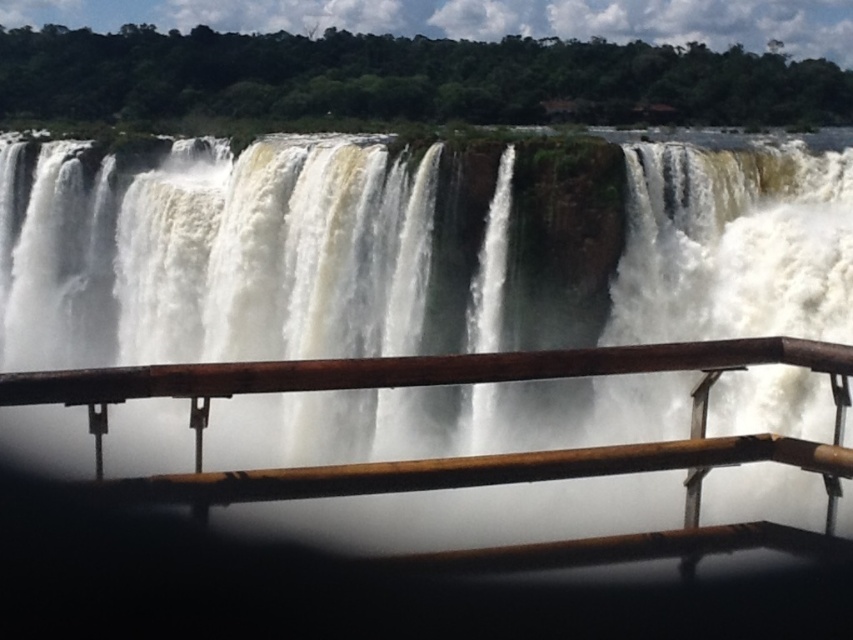
You are a park ranger assessing safety conditions at the waterfall. You notice the white frothy water at center and the brown wooden rail at center. Based on their heights, which one is higher from the ground?

The white frothy water at center is taller than the brown wooden rail at center, so the white frothy water at center is higher from the ground.

You are a photographer wanting to capture the white frothy water at center and the brown wooden rail at center in a single frame. Which object will occupy more horizontal space in the photo?

The white frothy water at center will occupy more horizontal space in the photo since its width surpasses that of the brown wooden rail at center.